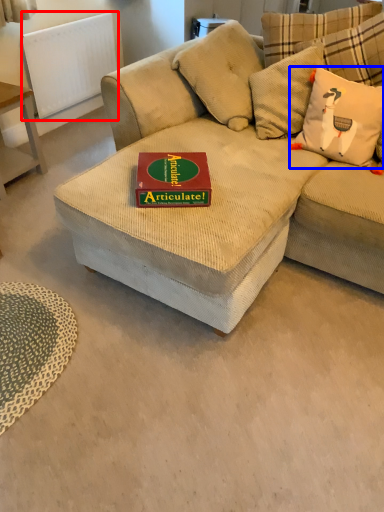
Question: Among these objects, which one is farthest to the camera, radiator (highlighted by a red box) or throw pillow (highlighted by a blue box)?

Choices:
 (A) radiator
 (B) throw pillow

Answer: (A)